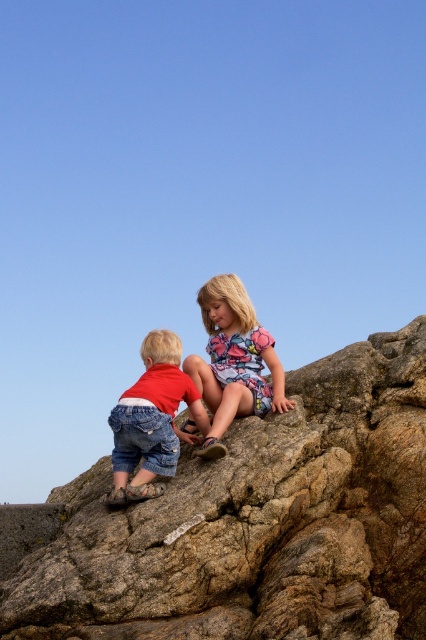
Which is more to the right, brown rough rock at center or denim shorts at lower left?

brown rough rock at center is more to the right.

Who is lower down, brown rough rock at center or denim shorts at lower left?

brown rough rock at center is below.

Is point (180, 582) positioned behind point (161, 460)?

No, it is not.

Image resolution: width=426 pixels, height=640 pixels. What are the coordinates of `brown rough rock at center` in the screenshot? It's located at (258, 524).

Can you confirm if brown rough rock at center is taller than floral fabric dress at center?

Incorrect, brown rough rock at center's height is not larger of floral fabric dress at center's.

Between brown rough rock at center and floral fabric dress at center, which one appears on the left side from the viewer's perspective?

From the viewer's perspective, floral fabric dress at center appears more on the left side.

Between point (379, 532) and point (224, 304), which one is positioned in front?

Positioned in front is point (379, 532).

The width and height of the screenshot is (426, 640). What are the coordinates of `brown rough rock at center` in the screenshot? It's located at (258, 524).

In the scene shown: How much distance is there between floral fabric dress at center and denim shorts at lower left?

The distance of floral fabric dress at center from denim shorts at lower left is 56.85 centimeters.

Does floral fabric dress at center appear over denim shorts at lower left?

Yes, floral fabric dress at center is above denim shorts at lower left.

Identify the location of floral fabric dress at center. (233, 360).

What are the coordinates of `floral fabric dress at center` in the screenshot? It's located at (233, 360).